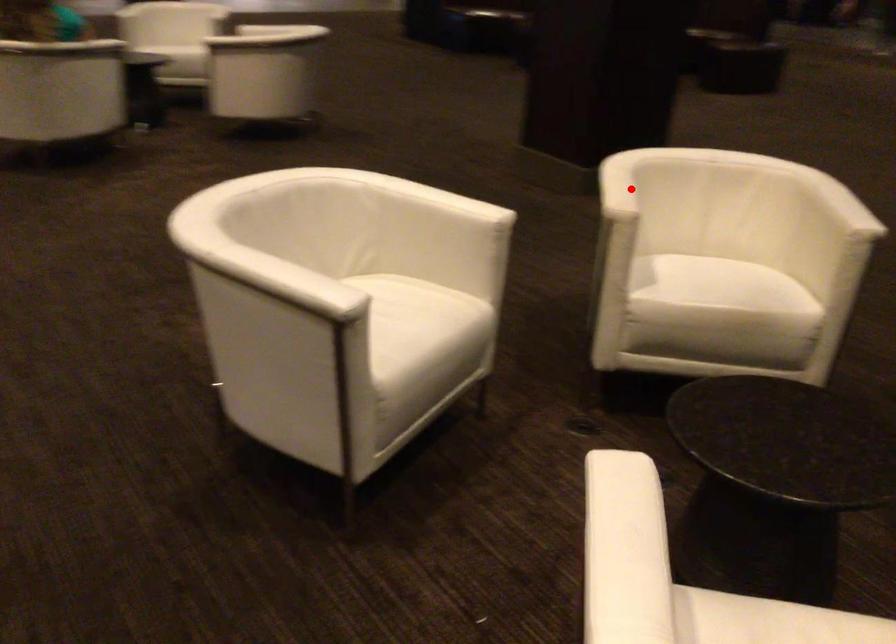
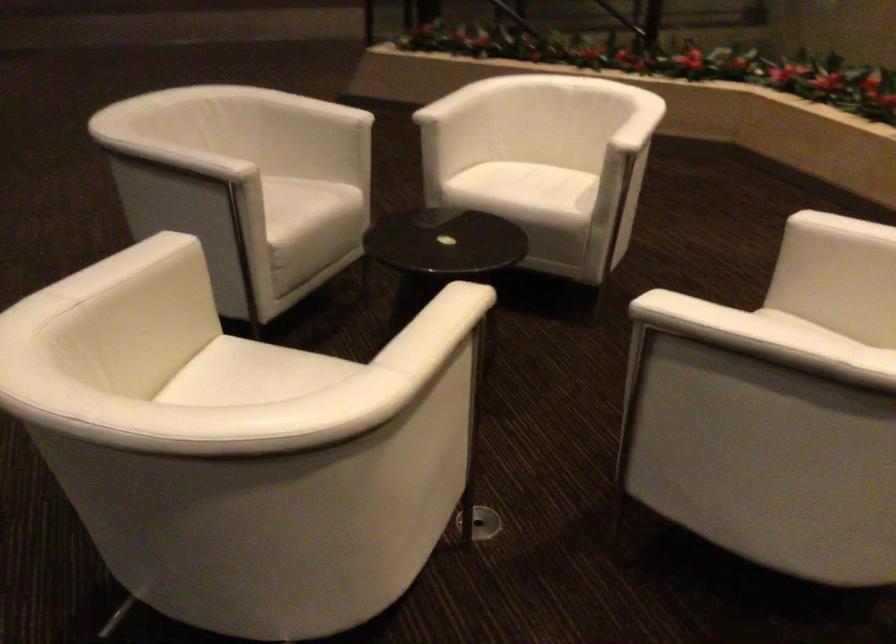
Where in the second image is the point corresponding to the highlighted location from the first image?

(437, 308)